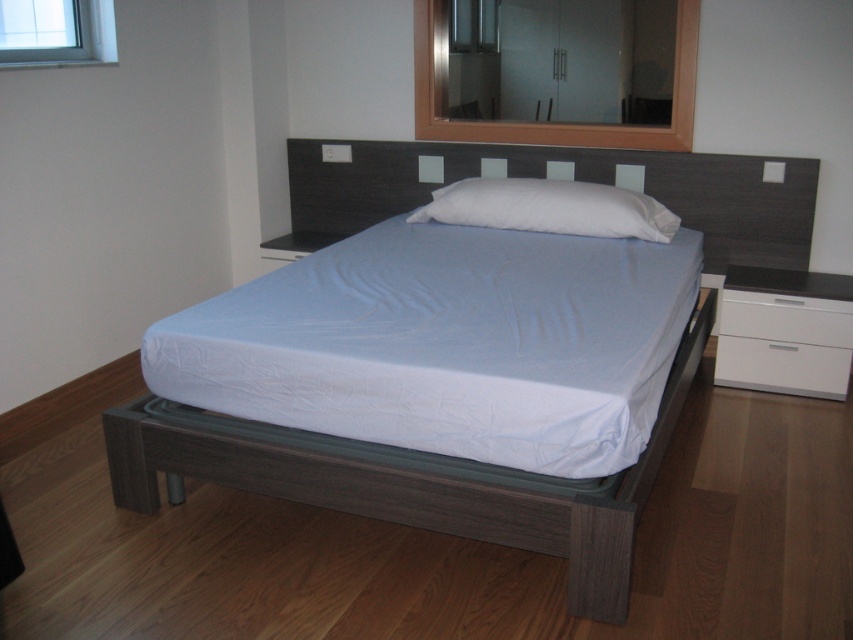
Question: Which point appears farthest from the camera in this image?

Choices:
 (A) (788, 310)
 (B) (567, 204)

Answer: (B)

Question: Is white fabric mattress at center bigger than white glossy dresser at right?

Choices:
 (A) no
 (B) yes

Answer: (B)

Question: Among these points, which one is nearest to the camera?

Choices:
 (A) (193, 397)
 (B) (796, 276)

Answer: (A)

Question: Does white fabric mattress at center have a lesser width compared to white glossy drawer at right?

Choices:
 (A) no
 (B) yes

Answer: (A)

Question: Is dark wood headboard at center smaller than white matte drawer at lower right?

Choices:
 (A) yes
 (B) no

Answer: (B)

Question: Among these objects, which one is farthest from the camera?

Choices:
 (A) dark wood bed frame at center
 (B) white soft pillow at center
 (C) white matte drawer at lower right

Answer: (B)